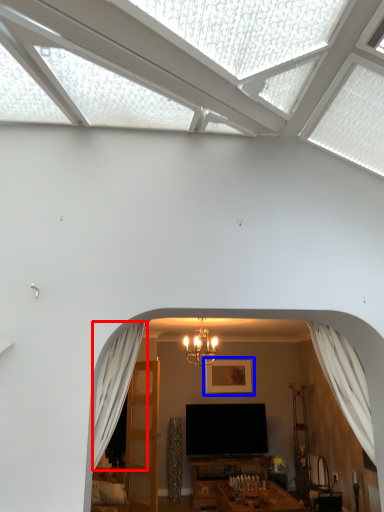
Question: Which point is closer to the camera, curtain (highlighted by a red box) or picture frame (highlighted by a blue box)?

Choices:
 (A) curtain
 (B) picture frame

Answer: (A)